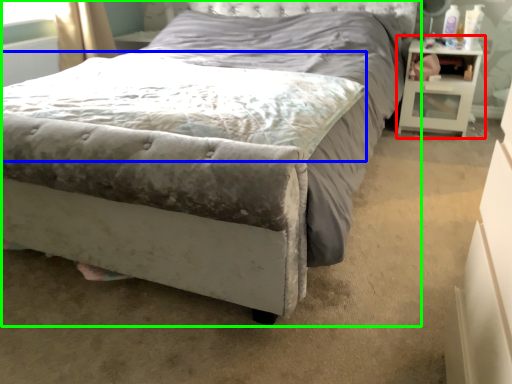
Question: Considering the real-world distances, which object is farthest from nightstand (highlighted by a red box)? mattress (highlighted by a blue box) or bed (highlighted by a green box)?

Choices:
 (A) mattress
 (B) bed

Answer: (A)